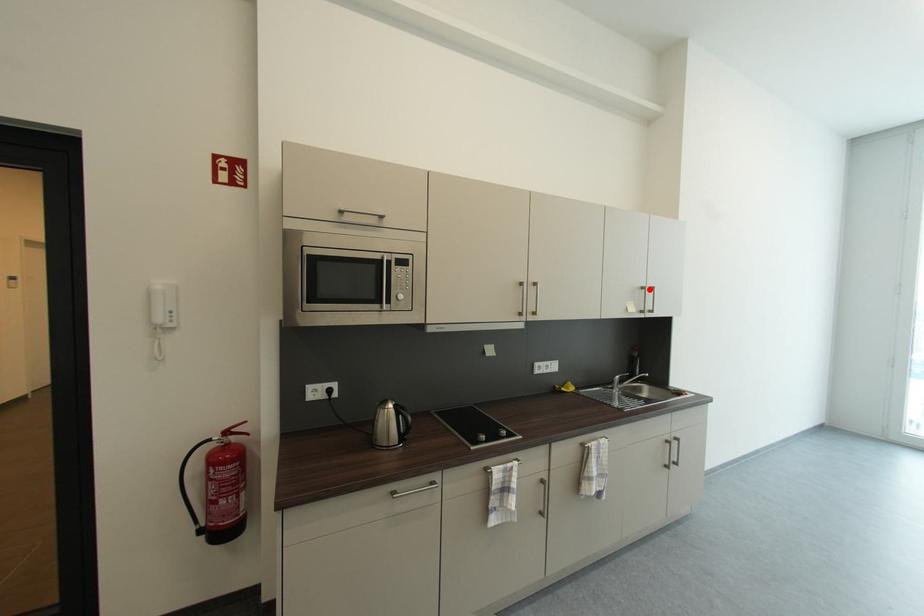
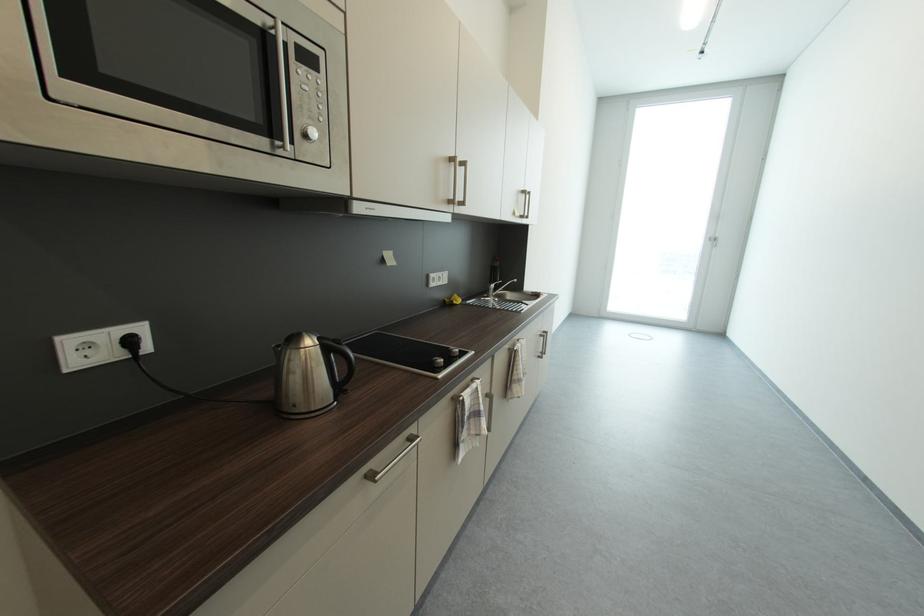
Where in the second image is the point corresponding to the highlighted location from the first image?

(529, 193)